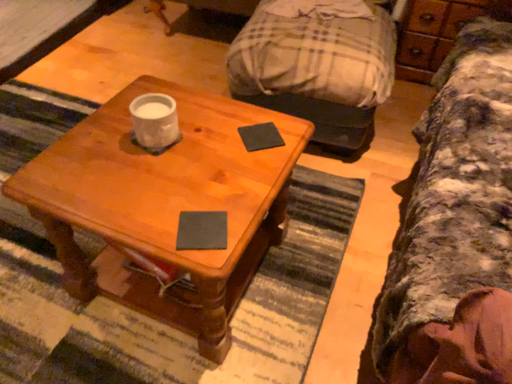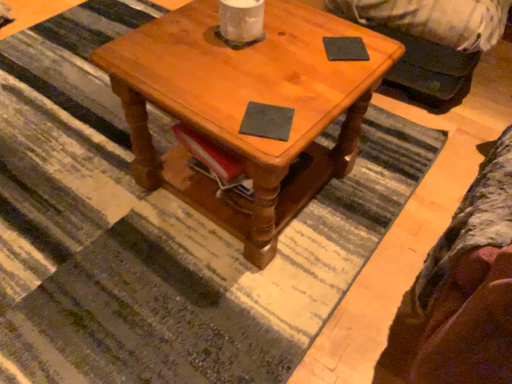
Question: How did the camera likely rotate when shooting the video?

Choices:
 (A) rotated left
 (B) rotated right

Answer: (A)